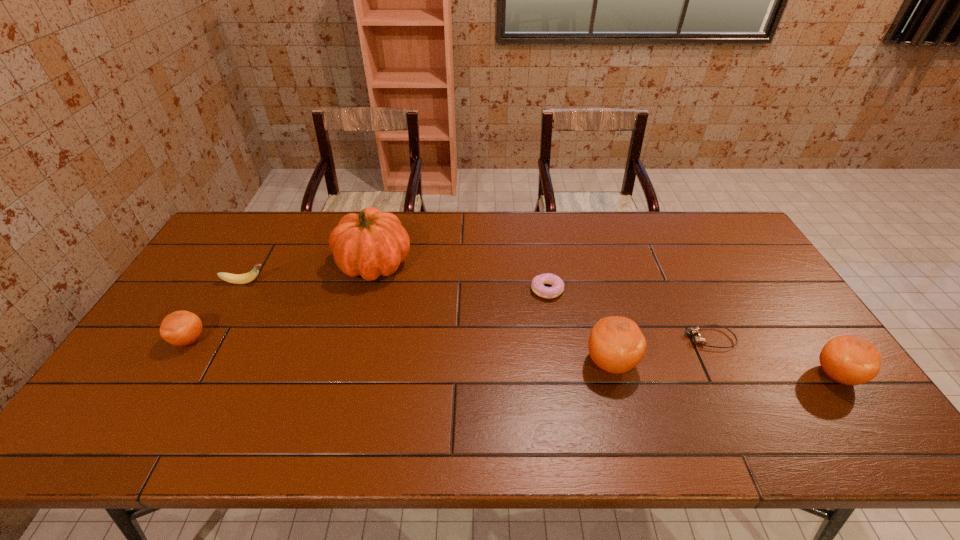
The width and height of the screenshot is (960, 540). Find the location of `free location located 0.340m on the front lenses and sides of the shortest object`. free location located 0.340m on the front lenses and sides of the shortest object is located at coordinates (561, 339).

Locate an element on the screen. free spot located 0.220m at the stem of the banana is located at coordinates (340, 282).

The image size is (960, 540). In order to click on object at the far edge in this screenshot , I will do `click(372, 243)`.

This screenshot has width=960, height=540. What are the coordinates of `orange situated at the left edge` in the screenshot? It's located at (181, 328).

The height and width of the screenshot is (540, 960). In order to click on banana positioned at the left edge in this screenshot , I will do `click(245, 278)`.

Locate an element on the screen. The height and width of the screenshot is (540, 960). object present at the right edge is located at coordinates (850, 360).

In order to click on object at the near right corner in this screenshot , I will do `click(850, 360)`.

I want to click on blank area at the far edge, so click(683, 242).

Where is `free space at the near edge`? Image resolution: width=960 pixels, height=540 pixels. free space at the near edge is located at coordinates (474, 382).

What are the coordinates of `free space at the left edge` in the screenshot? It's located at (205, 256).